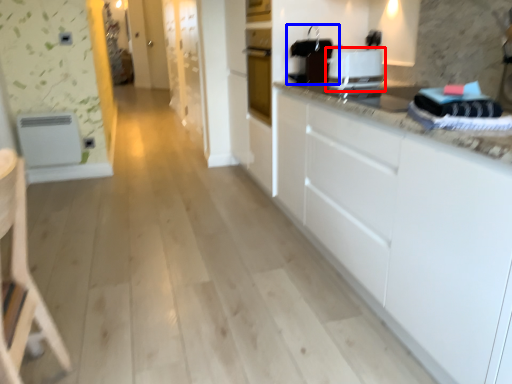
Question: Among these objects, which one is farthest to the camera, home appliance (highlighted by a red box) or appliance (highlighted by a blue box)?

Choices:
 (A) home appliance
 (B) appliance

Answer: (B)